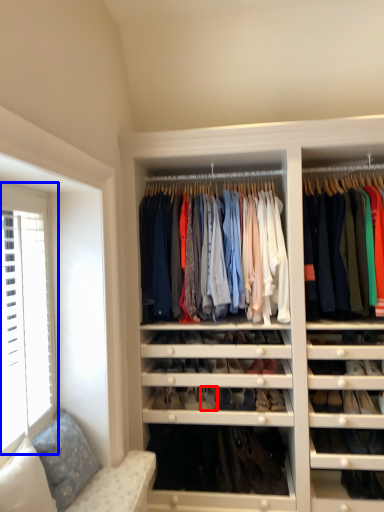
Question: Which point is further to the camera, shoe (highlighted by a red box) or window (highlighted by a blue box)?

Choices:
 (A) shoe
 (B) window

Answer: (A)